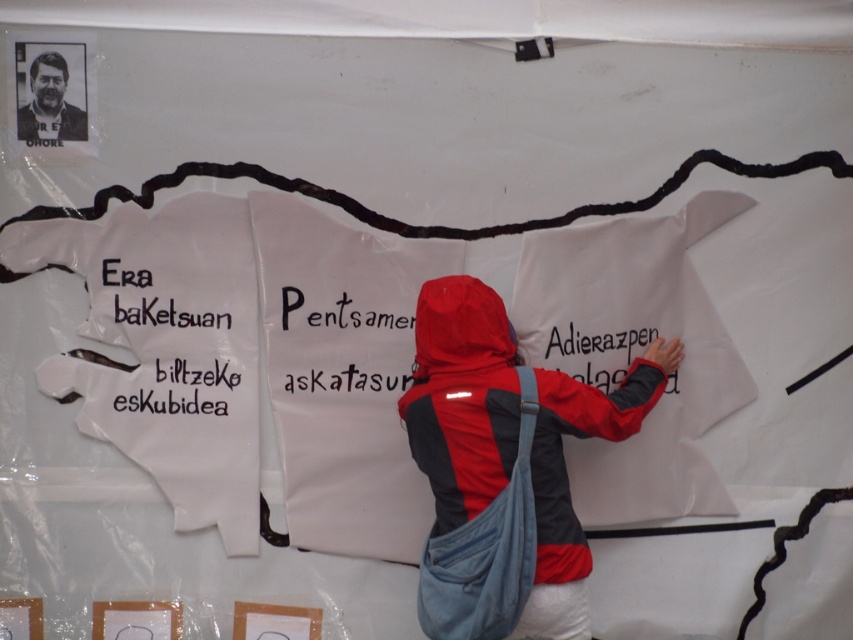
Can you confirm if red fabric jacket at center is bigger than black paper at center?

Yes, red fabric jacket at center is bigger than black paper at center.

Is red fabric jacket at center above black paper at center?

No.

Between point (584, 385) and point (405, 337), which one is positioned in front?

Positioned in front is point (584, 385).

Find the location of a particular element. red fabric jacket at center is located at coordinates (462, 397).

Can you confirm if red fabric jacket at center is smaller than black paper at left?

Incorrect, red fabric jacket at center is not smaller in size than black paper at left.

Who is more forward, (451, 420) or (103, 276)?

Point (451, 420) is more forward.

Image resolution: width=853 pixels, height=640 pixels. In order to click on red fabric jacket at center in this screenshot , I will do `click(462, 397)`.

Is point (163, 356) positioned in front of point (62, 70)?

No, (163, 356) is behind (62, 70).

The width and height of the screenshot is (853, 640). I want to click on black paper at left, so click(x=184, y=332).

Where is `black paper at left`? black paper at left is located at coordinates (184, 332).